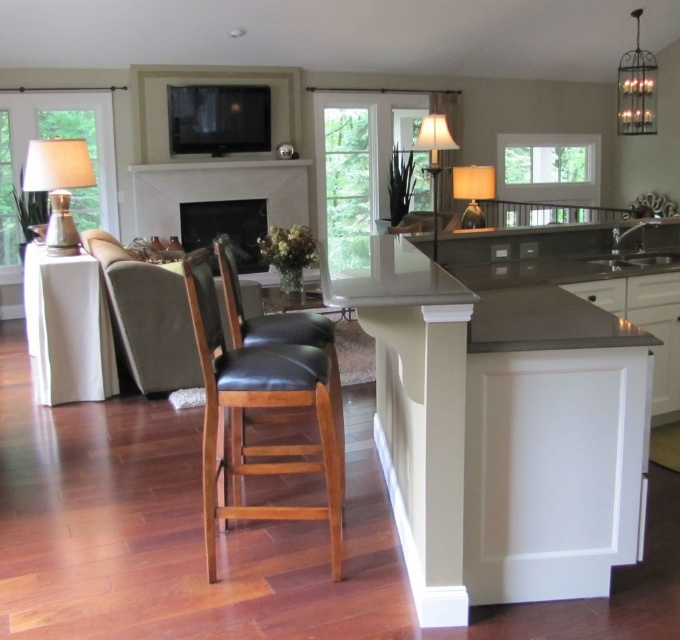
Is smooth gray countertop at center positioned behind white marble fireplace at center?

No, smooth gray countertop at center is in front of white marble fireplace at center.

How distant is smooth gray countertop at center from white marble fireplace at center?

smooth gray countertop at center is 4.49 meters away from white marble fireplace at center.

Find the location of a particular element. smooth gray countertop at center is located at coordinates (500, 412).

Who is lower down, dark gray polished stone counter top at center or matte brown table lamp at upper right?

dark gray polished stone counter top at center is lower down.

Based on the photo, is dark gray polished stone counter top at center shorter than matte brown table lamp at upper right?

Yes, dark gray polished stone counter top at center is shorter than matte brown table lamp at upper right.

Who is more forward, (562, 246) or (479, 196)?

Point (562, 246)

Where is `dark gray polished stone counter top at center`? The height and width of the screenshot is (640, 680). dark gray polished stone counter top at center is located at coordinates [x=503, y=282].

Who is positioned more to the left, smooth gray countertop at center or dark gray polished stone counter top at center?

Positioned to the left is smooth gray countertop at center.

Which is in front, point (456, 264) or point (343, 282)?

Point (343, 282) is in front.

Between point (594, 570) and point (579, 227), which one is positioned behind?

Point (579, 227)

This screenshot has width=680, height=640. What are the coordinates of `smooth gray countertop at center` in the screenshot? It's located at (500, 412).